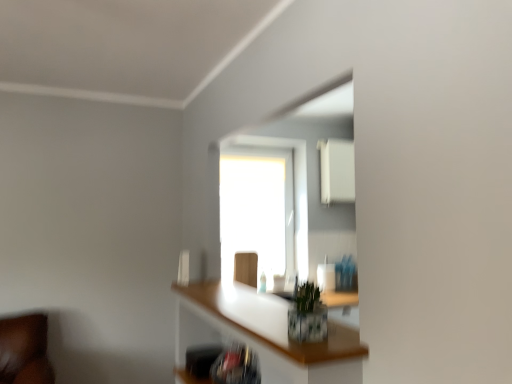
Question: Is transparent glass window at center thinner than wooden swivel chair at center?

Choices:
 (A) yes
 (B) no

Answer: (B)

Question: From the image's perspective, is transparent glass window at center above wooden swivel chair at center?

Choices:
 (A) yes
 (B) no

Answer: (A)

Question: Is transparent glass window at center in contact with wooden swivel chair at center?

Choices:
 (A) yes
 (B) no

Answer: (B)

Question: Is transparent glass window at center at the left side of wooden swivel chair at center?

Choices:
 (A) no
 (B) yes

Answer: (B)

Question: From the image's perspective, is transparent glass window at center below wooden swivel chair at center?

Choices:
 (A) no
 (B) yes

Answer: (A)

Question: From their relative heights in the image, would you say green leafy plant at center is taller or shorter than transparent glass window at center?

Choices:
 (A) tall
 (B) short

Answer: (B)

Question: Is green leafy plant at center to the left or to the right of transparent glass window at center in the image?

Choices:
 (A) right
 (B) left

Answer: (A)

Question: From the image's perspective, is green leafy plant at center above or below transparent glass window at center?

Choices:
 (A) above
 (B) below

Answer: (B)

Question: From a real-world perspective, is green leafy plant at center positioned above or below transparent glass window at center?

Choices:
 (A) above
 (B) below

Answer: (B)

Question: From a real-world perspective, is wooden swivel chair at center positioned above or below green leafy plant at center?

Choices:
 (A) below
 (B) above

Answer: (A)

Question: Choose the correct answer: Is wooden swivel chair at center inside green leafy plant at center or outside it?

Choices:
 (A) outside
 (B) inside

Answer: (A)

Question: In the image, is wooden swivel chair at center on the left side or the right side of green leafy plant at center?

Choices:
 (A) right
 (B) left

Answer: (B)

Question: In terms of size, does wooden swivel chair at center appear bigger or smaller than green leafy plant at center?

Choices:
 (A) small
 (B) big

Answer: (B)

Question: Is transparent glass window at center to the left or to the right of green leafy plant at center in the image?

Choices:
 (A) right
 (B) left

Answer: (B)

Question: In terms of size, does transparent glass window at center appear bigger or smaller than green leafy plant at center?

Choices:
 (A) small
 (B) big

Answer: (B)